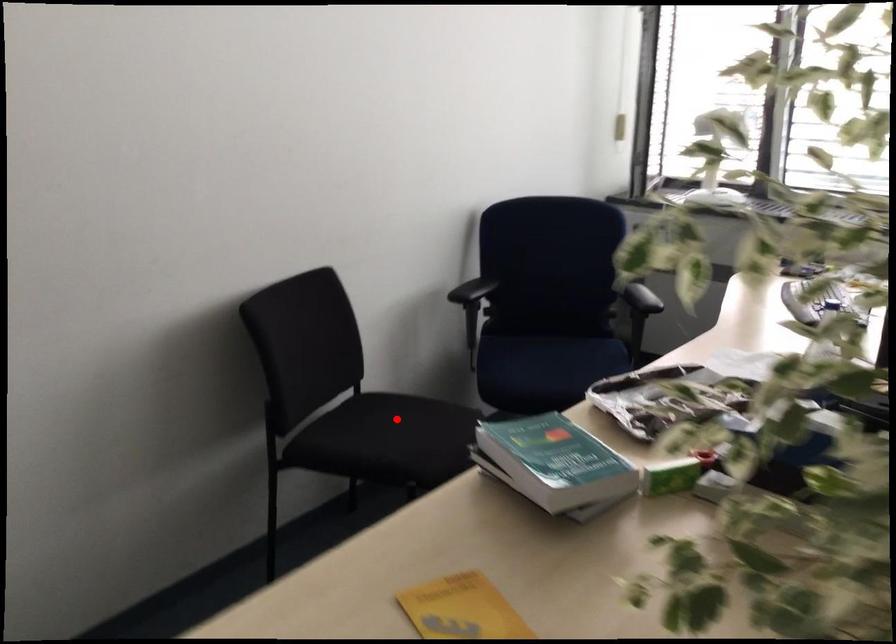
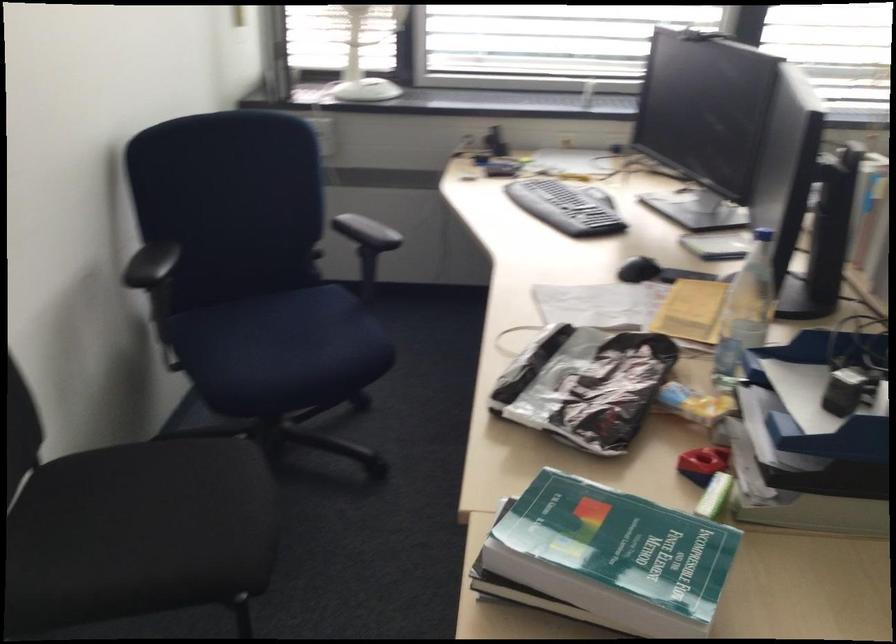
Question: I am providing you with two images of the same scene from different viewpoints. Given a red point in image1, look at the same physical point in image2. Is it:

Choices:
 (A) Closer to the viewpoint
 (B) Farther from the viewpoint

Answer: (A)